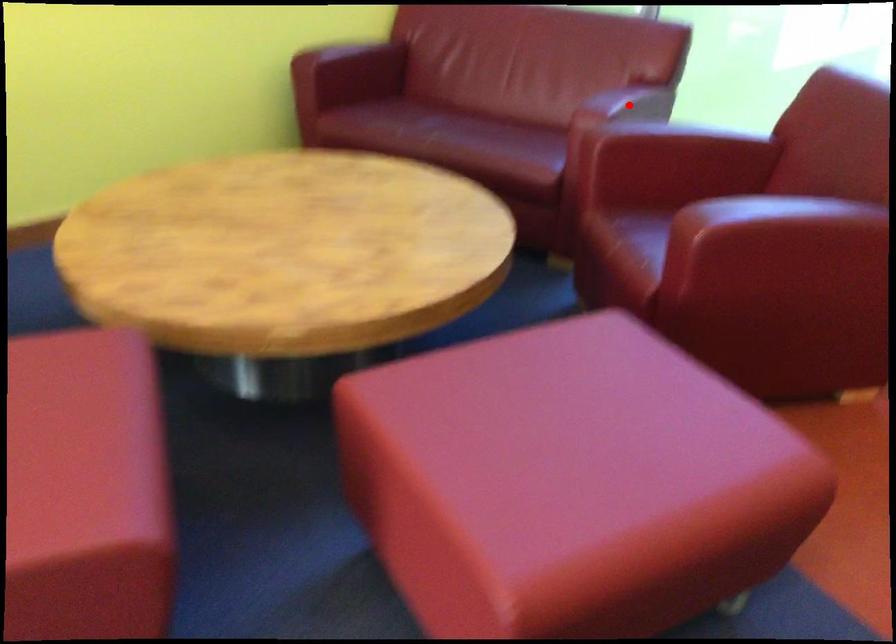
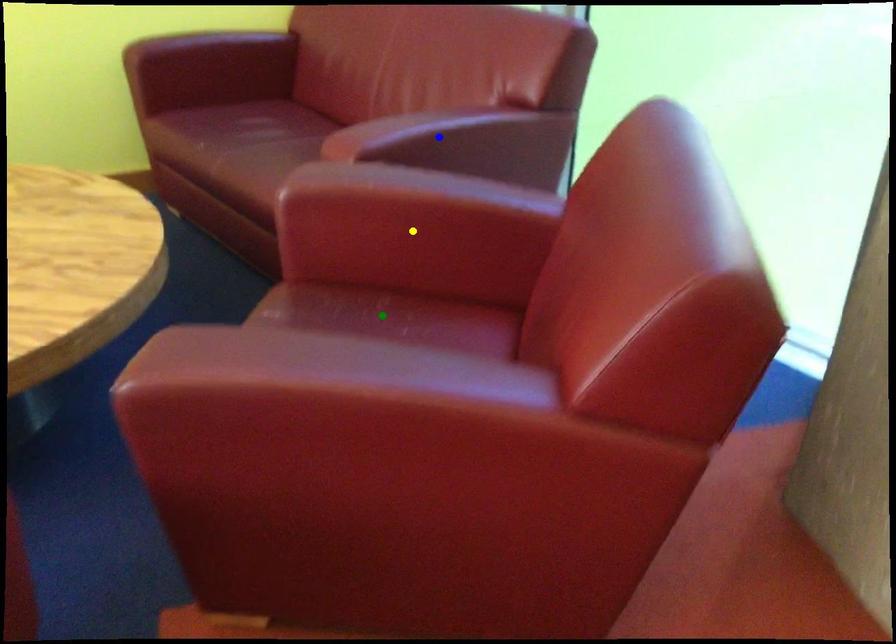
Question: I am providing you with two images of the same scene from different viewpoints. A red point is marked on the first image. You are given multiple points on the second image. In image 2, which mark is for the same physical point as the one in image 1?

Choices:
 (A) green point
 (B) yellow point
 (C) blue point

Answer: (C)